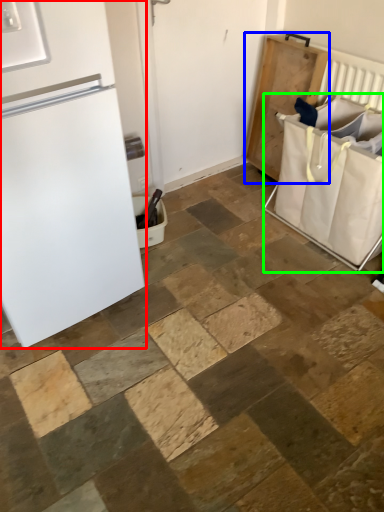
Question: Considering the real-world distances, which object is closest to refrigerator (highlighted by a red box)? changing table (highlighted by a blue box) or laundry basket (highlighted by a green box).

Choices:
 (A) changing table
 (B) laundry basket

Answer: (B)